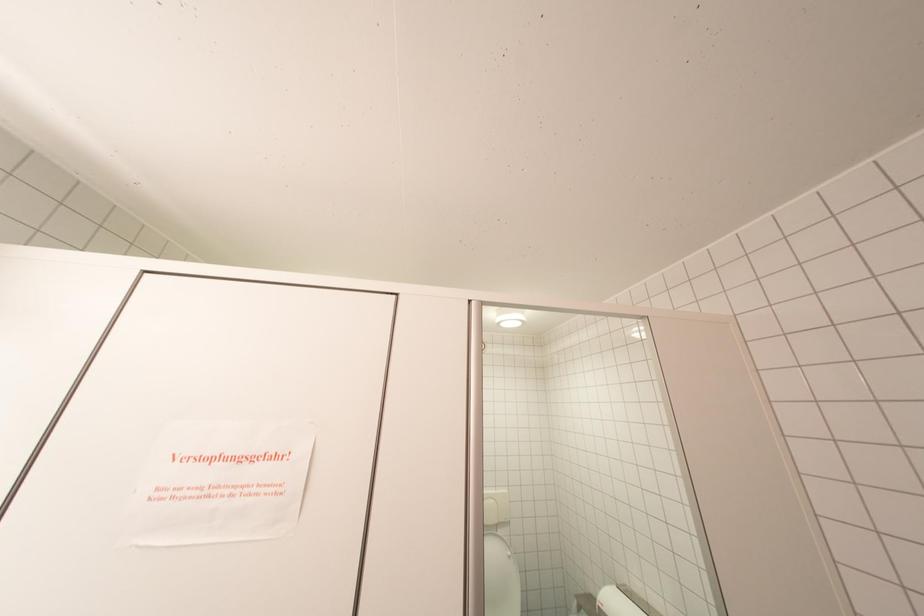
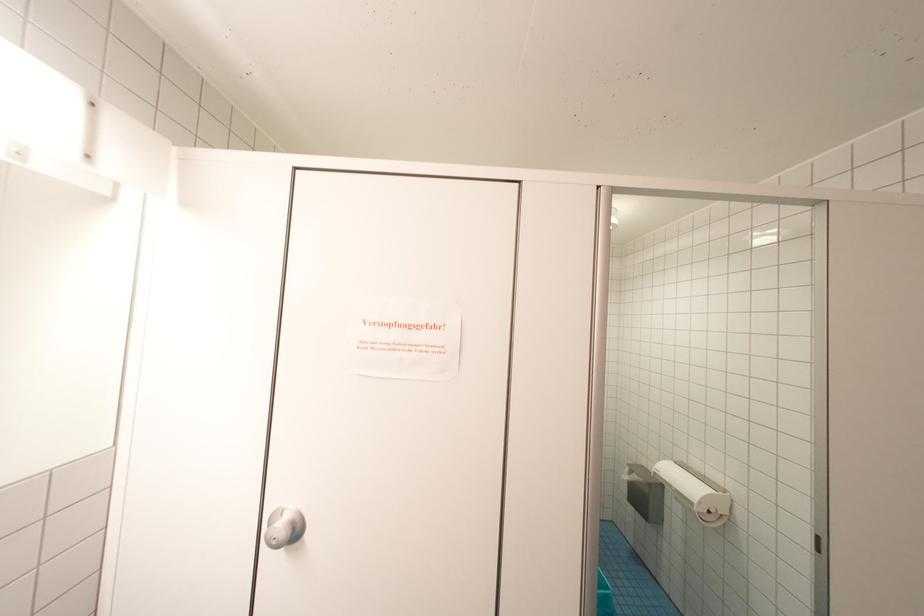
Question: The first image is from the beginning of the video and the second image is from the end. How did the camera likely rotate when shooting the video?

Choices:
 (A) Left
 (B) Right
 (C) Up
 (D) Down

Answer: (D)